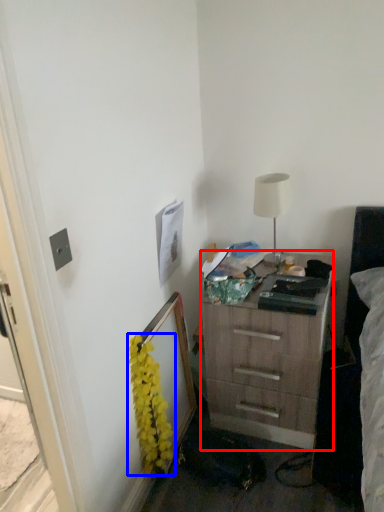
Question: Which object is further to the camera taking this photo, chest of drawers (highlighted by a red box) or flower (highlighted by a blue box)?

Choices:
 (A) chest of drawers
 (B) flower

Answer: (A)